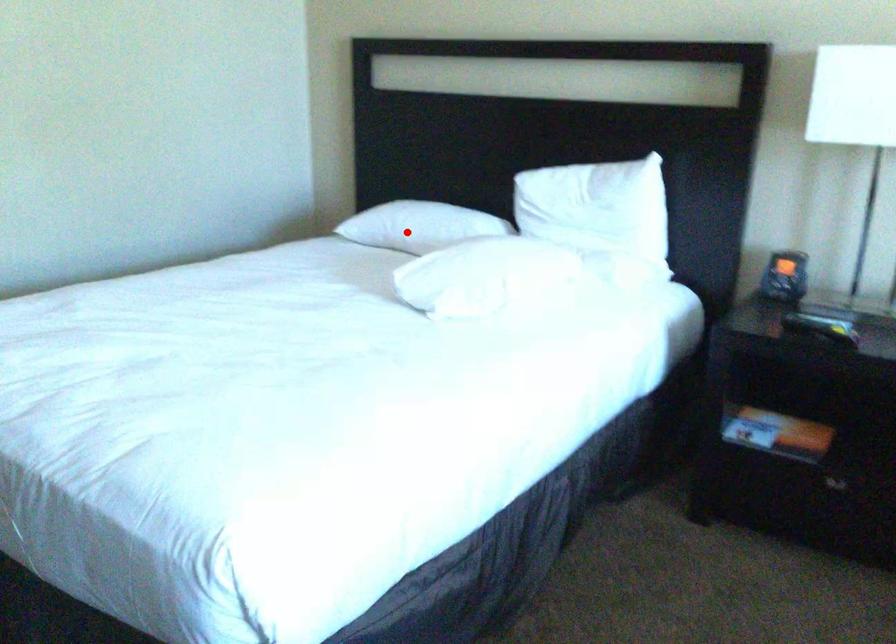
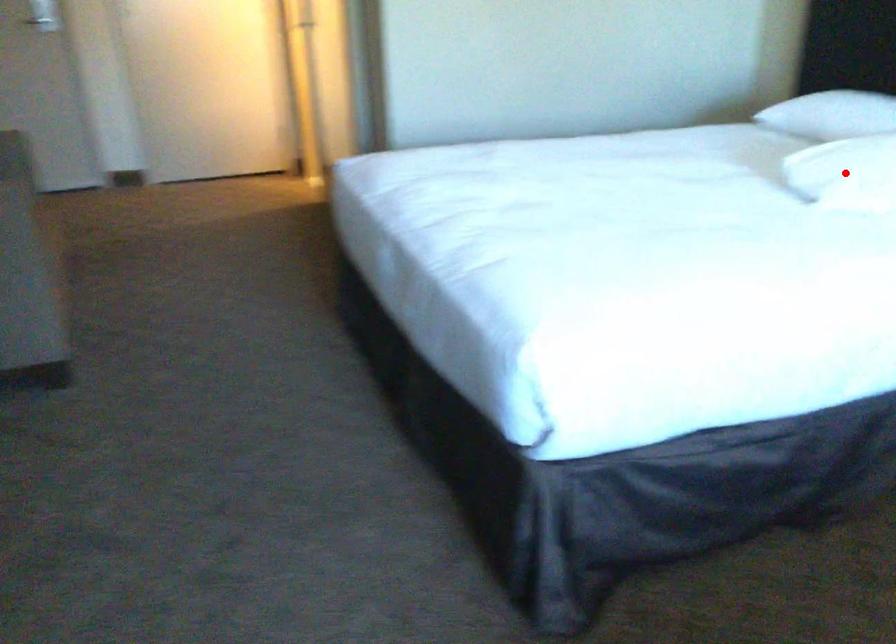
I am providing you with two images of the same scene from different viewpoints. A red point is marked on the first image and another point is marked on the second image. Is the red point in image1 aligned with the point shown in image2?

No